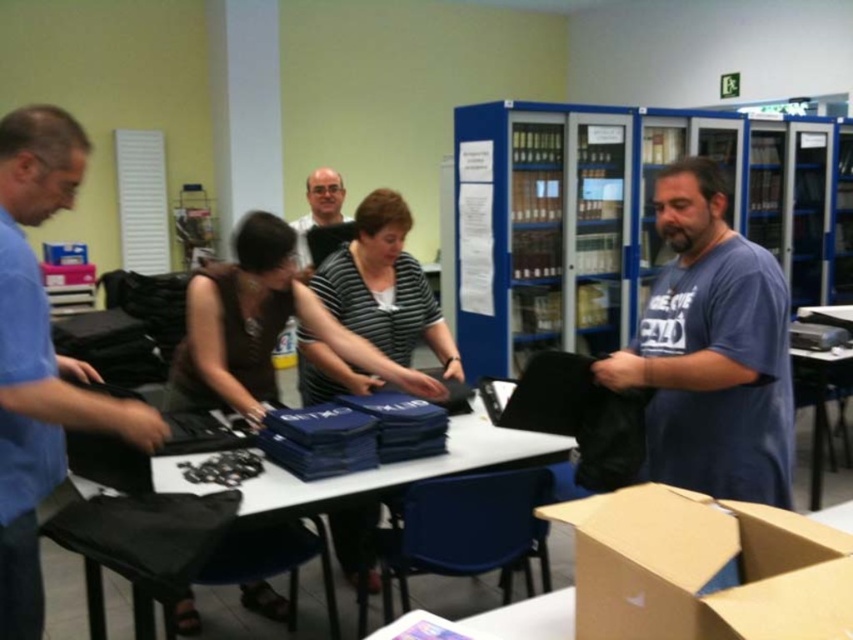
You are standing in the room and want to place a new book on the blue plastic bookshelf at upper center. To reach it, you must walk around the black plastic table at center. Which direction should you walk around the table to face the bookshelf?

Since the blue plastic bookshelf at upper center is to the left of the black plastic table at center, you should walk around the right side of the black plastic table at center to face the bookshelf.